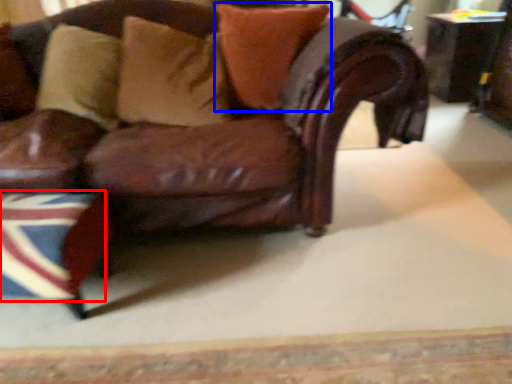
Question: Which object is closer to the camera taking this photo, flag (highlighted by a red box) or pillow (highlighted by a blue box)?

Choices:
 (A) flag
 (B) pillow

Answer: (A)